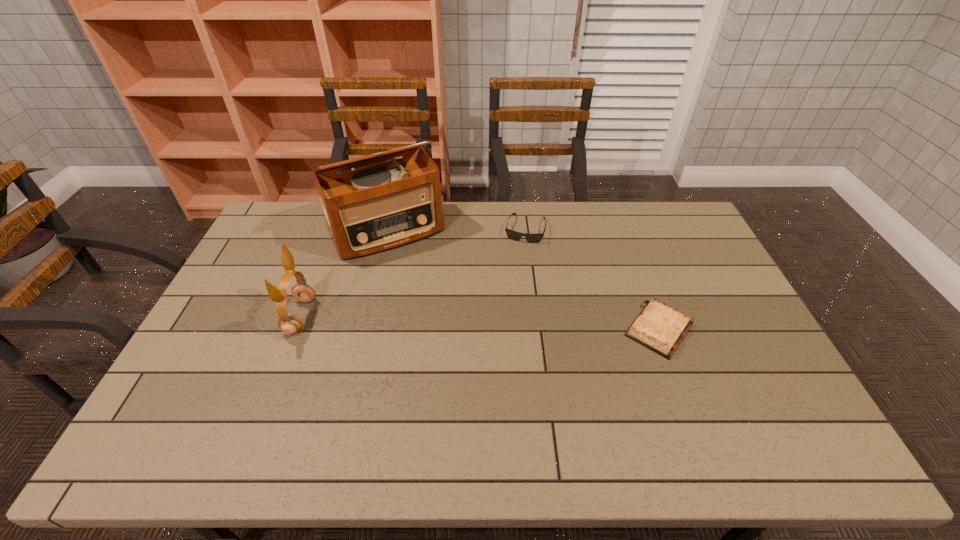
Find the location of a particular element. Image resolution: width=960 pixels, height=540 pixels. free space between the tallest object and the rightmost object is located at coordinates (523, 280).

At what (x,y) coordinates should I click in order to perform the action: click on free point between the second object from right to left and the diary. Please return your answer as a coordinate pair (x, y). This screenshot has width=960, height=540. Looking at the image, I should click on (592, 279).

Locate an element on the screen. Image resolution: width=960 pixels, height=540 pixels. vacant area between the radio receiver and the earphone is located at coordinates (344, 274).

Find the location of a particular element. the second closest object to the shortest object is located at coordinates (381, 207).

Locate which object is the second closest to the shortest object. Please provide its 2D coordinates. Your answer should be formatted as a tuple, i.e. [(x, y)], where the tuple contains the x and y coordinates of a point satisfying the conditions above.

[(381, 207)]

Where is `vacant area in the image that satisfies the following two spatial constraints: 1. on the front side of the rightmost object; 2. on the right side of the radio receiver`? vacant area in the image that satisfies the following two spatial constraints: 1. on the front side of the rightmost object; 2. on the right side of the radio receiver is located at coordinates (363, 329).